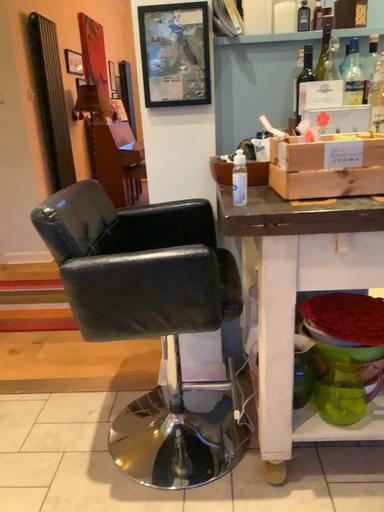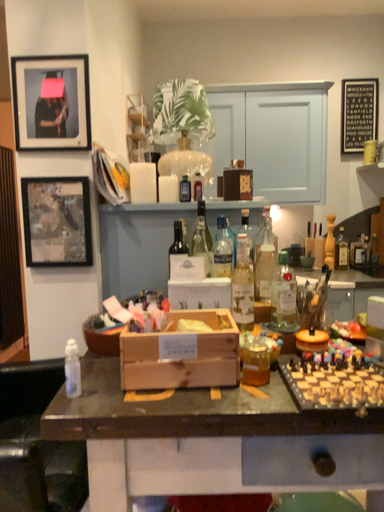
Question: How did the camera likely rotate when shooting the video?

Choices:
 (A) rotated downward
 (B) rotated upward

Answer: (B)